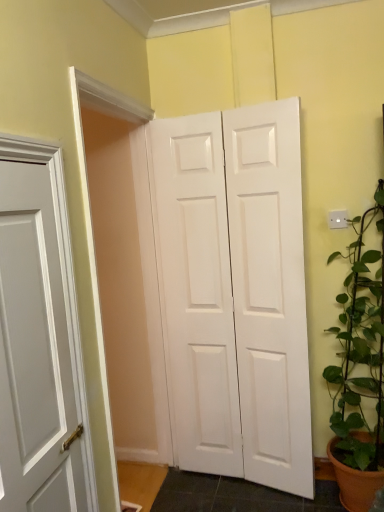
Locate an element on the screen. The image size is (384, 512). green leafy plant at right is located at coordinates (356, 366).

What do you see at coordinates (356, 366) in the screenshot? I see `green leafy plant at right` at bounding box center [356, 366].

Measure the distance between white matte door at center and camera.

A distance of 6.21 feet exists between white matte door at center and camera.

At what (x,y) coordinates should I click in order to perform the action: click on white matte door at center. Please return your answer as a coordinate pair (x, y). Looking at the image, I should click on (234, 292).

The image size is (384, 512). What do you see at coordinates (234, 292) in the screenshot?
I see `white matte door at center` at bounding box center [234, 292].

I want to click on green leafy plant at right, so click(x=356, y=366).

Which is more to the right, white matte door at center or green leafy plant at right?

From the viewer's perspective, green leafy plant at right appears more on the right side.

In the scene shown: Is white matte door at center behind green leafy plant at right?

Yes, it is.

Which is closer to the camera, (255, 328) or (340, 500)?

The point (340, 500) is closer.

From the image's perspective, which one is positioned lower, white matte door at center or green leafy plant at right?

green leafy plant at right, from the image's perspective.

From a real-world perspective, which is physically above, white matte door at center or green leafy plant at right?

From a 3D spatial view, white matte door at center is above.

Looking at this image, looking at their sizes, would you say white matte door at center is wider or thinner than green leafy plant at right?

Considering their sizes, white matte door at center looks slimmer than green leafy plant at right.

Can you confirm if white matte door at center is taller than green leafy plant at right?

Correct, white matte door at center is much taller as green leafy plant at right.

Does white matte door at center have a larger size compared to green leafy plant at right?

Actually, white matte door at center might be smaller than green leafy plant at right.

Which is correct: white matte door at center is inside green leafy plant at right, or outside of it?

white matte door at center is not inside green leafy plant at right, it's outside.

Looking at this image, is the surface of white matte door at center in direct contact with green leafy plant at right?

No, white matte door at center is not with green leafy plant at right.

Is white matte door at center facing towards green leafy plant at right?

No.

How distant is white matte door at center from green leafy plant at right?

They are 19.05 inches apart.

Identify the location of houseplant lying below the white matte door at center (from the image's perspective). (356, 366).

Is green leafy plant at right to the left or to the right of white matte door at center in the image?

green leafy plant at right is positioned on white matte door at center's right side.

Is green leafy plant at right further to camera compared to white matte door at center?

No, green leafy plant at right is closer to the viewer.

Which point is more forward, (380,443) or (178,177)?

The point (380,443) is more forward.

From the image's perspective, relative to white matte door at center, is green leafy plant at right above or below?

Clearly, from the image's perspective, green leafy plant at right is below white matte door at center.

From a real-world perspective, is green leafy plant at right above or below white matte door at center?

In terms of real-world spatial position, green leafy plant at right is below white matte door at center.

Is green leafy plant at right wider or thinner than white matte door at center?

Clearly, green leafy plant at right has more width compared to white matte door at center.

Between green leafy plant at right and white matte door at center, which one has more height?

Standing taller between the two is white matte door at center.

Considering the sizes of objects green leafy plant at right and white matte door at center in the image provided, who is smaller, green leafy plant at right or white matte door at center?

With smaller size is white matte door at center.

Is green leafy plant at right completely or partially outside of white matte door at center?

Yes, green leafy plant at right is located beyond the bounds of white matte door at center.

Does green leafy plant at right touch white matte door at center?

No, green leafy plant at right is not in contact with white matte door at center.

Is green leafy plant at right aimed at white matte door at center?

No, green leafy plant at right is not oriented towards white matte door at center.

How different are the orientations of green leafy plant at right and white matte door at center in degrees?

5.81 degrees.

How much distance is there between green leafy plant at right and white matte door at center?

green leafy plant at right is 19.05 inches from white matte door at center.

This screenshot has width=384, height=512. I want to click on door that appears above the green leafy plant at right (from a real-world perspective), so click(x=234, y=292).

This screenshot has height=512, width=384. In order to click on houseplant below the white matte door at center (from the image's perspective) in this screenshot , I will do `click(356, 366)`.

Where is `door behind the green leafy plant at right`? Image resolution: width=384 pixels, height=512 pixels. door behind the green leafy plant at right is located at coordinates (234, 292).